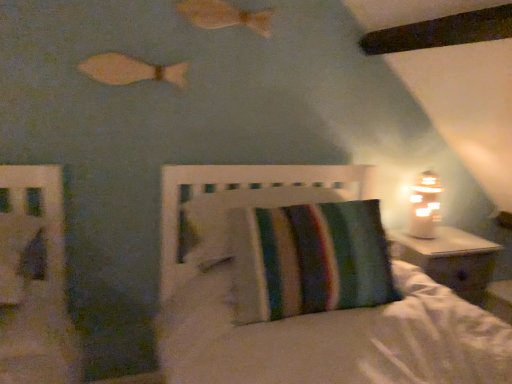
Question: Should I look upward or downward to see striped fabric pillow at center?

Choices:
 (A) down
 (B) up

Answer: (A)

Question: From the image's perspective, is wooden fish at upper center, the 2th fish from the bottom, over white frosted glass table lamp at right?

Choices:
 (A) no
 (B) yes

Answer: (B)

Question: From a real-world perspective, is wooden fish at upper center, positioned as the first fish in top-to-bottom order, positioned under white frosted glass table lamp at right based on gravity?

Choices:
 (A) yes
 (B) no

Answer: (B)

Question: Considering the relative positions of wooden fish at upper center, the 2th fish from the bottom, and white frosted glass table lamp at right in the image provided, is wooden fish at upper center, the 2th fish from the bottom, to the right of white frosted glass table lamp at right from the viewer's perspective?

Choices:
 (A) no
 (B) yes

Answer: (A)

Question: Considering the relative sizes of wooden fish at upper center, positioned as the 2th fish in left-to-right order, and white frosted glass table lamp at right in the image provided, is wooden fish at upper center, positioned as the 2th fish in left-to-right order, thinner than white frosted glass table lamp at right?

Choices:
 (A) no
 (B) yes

Answer: (B)

Question: Is the surface of wooden fish at upper center, the 2th fish from the bottom, in direct contact with white frosted glass table lamp at right?

Choices:
 (A) no
 (B) yes

Answer: (A)

Question: From a real-world perspective, is wooden fish at upper center, positioned as the 2th fish in left-to-right order, physically above white frosted glass table lamp at right?

Choices:
 (A) no
 (B) yes

Answer: (B)

Question: Is striped fabric headboard at center at the right side of wooden fish at upper left, which is the first fish from left to right?

Choices:
 (A) no
 (B) yes

Answer: (B)

Question: From a real-world perspective, is striped fabric headboard at center positioned over wooden fish at upper left, positioned as the 1th fish in bottom-to-top order, based on gravity?

Choices:
 (A) yes
 (B) no

Answer: (B)

Question: Is striped fabric headboard at center closer to camera compared to wooden fish at upper left, which is the first fish from left to right?

Choices:
 (A) yes
 (B) no

Answer: (A)

Question: Considering the relative sizes of striped fabric headboard at center and wooden fish at upper left, which is the first fish from left to right, in the image provided, is striped fabric headboard at center thinner than wooden fish at upper left, which is the first fish from left to right,?

Choices:
 (A) no
 (B) yes

Answer: (A)

Question: Would you say striped fabric headboard at center contains wooden fish at upper left, the second fish viewed from the top?

Choices:
 (A) yes
 (B) no

Answer: (B)

Question: Is striped fabric headboard at center next to wooden fish at upper left, which is the first fish from left to right?

Choices:
 (A) no
 (B) yes

Answer: (A)

Question: Can you confirm if wooden fish at upper center, positioned as the first fish in top-to-bottom order, is smaller than striped fabric headboard at center?

Choices:
 (A) yes
 (B) no

Answer: (A)